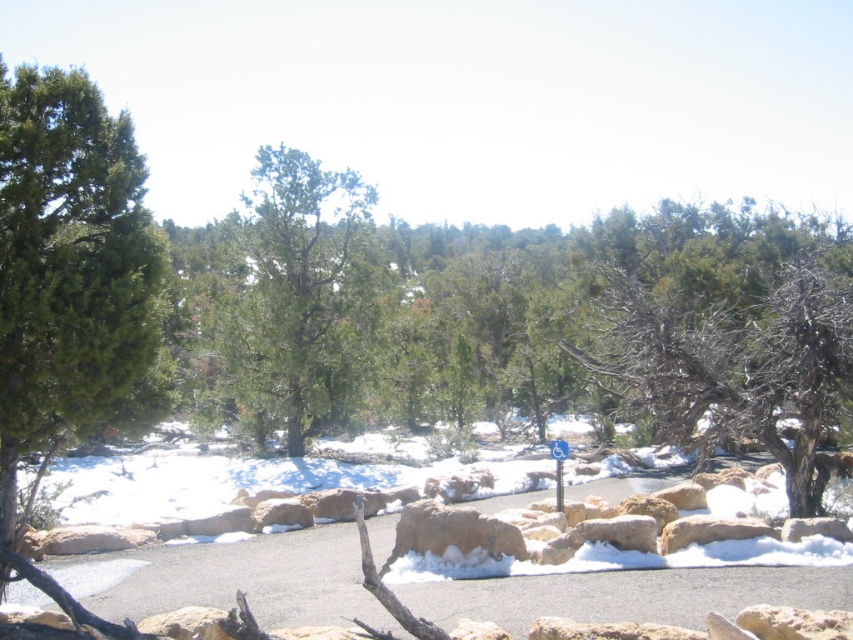
Can you confirm if green matte tree at center is positioned below blue plastic sign at center?

Incorrect, green matte tree at center is not positioned below blue plastic sign at center.

Measure the distance between point (297,179) and camera.

Point (297,179) and camera are 27.17 meters apart from each other.

Image resolution: width=853 pixels, height=640 pixels. What do you see at coordinates (294, 296) in the screenshot?
I see `green matte tree at center` at bounding box center [294, 296].

Find the location of a particular element. This screenshot has width=853, height=640. green matte tree at center is located at coordinates (294, 296).

Between green matte tree at left and green matte tree at center, which one is positioned lower?

green matte tree at left is lower down.

Is point (27, 140) more distant than point (292, 403)?

No, it is in front of (292, 403).

Locate an element on the screen. The height and width of the screenshot is (640, 853). green matte tree at left is located at coordinates (70, 269).

Between point (15, 157) and point (556, 483), which one is positioned in front?

Point (15, 157) is more forward.

Find the location of `green matte tree at left`. green matte tree at left is located at coordinates (70, 269).

Is point (141, 384) positioned behind point (555, 470)?

No.

This screenshot has width=853, height=640. I want to click on green matte tree at left, so click(70, 269).